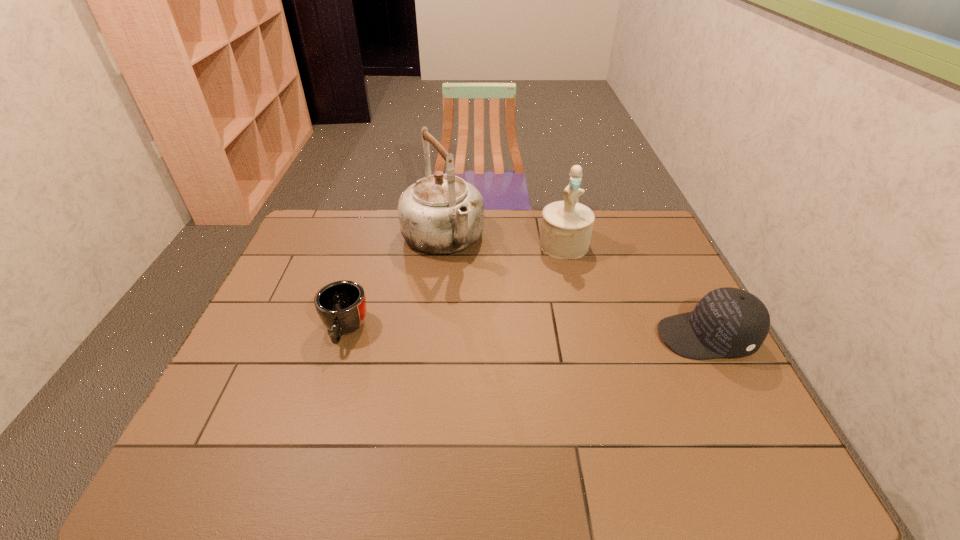
The height and width of the screenshot is (540, 960). In order to click on free space on the desktop that is between the shortest object and the second shortest object and is positioned at the beak of the second tallest object in this screenshot , I will do `click(566, 334)`.

Identify the location of vacant space on the desktop that is between the leftmost object and the rightmost object and is positioned at the spout of the third object from right to left. The height and width of the screenshot is (540, 960). (508, 333).